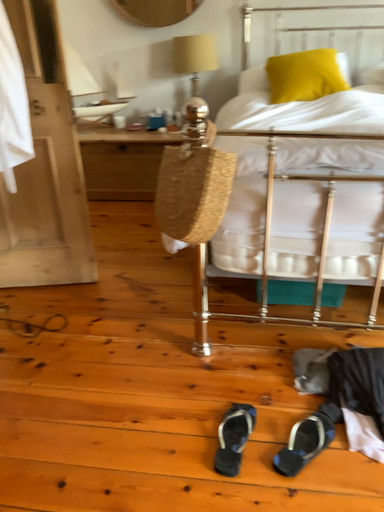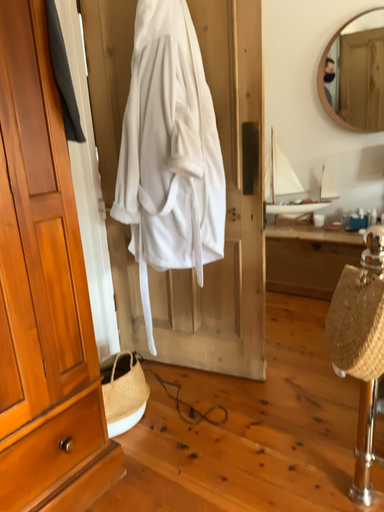
Question: Which way did the camera rotate in the video?

Choices:
 (A) rotated right
 (B) rotated left

Answer: (B)